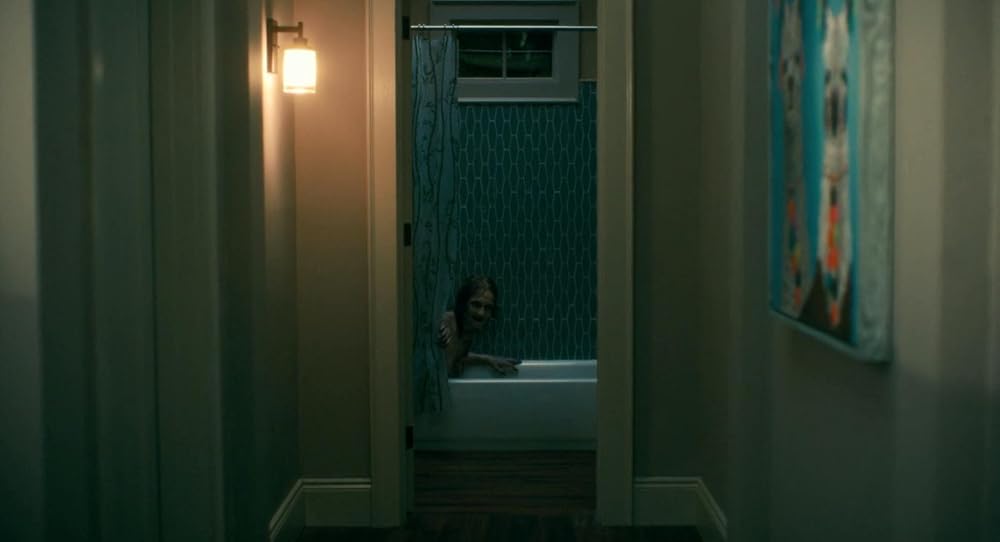
Locate an element on the screen. bathroom is located at coordinates (560, 216).